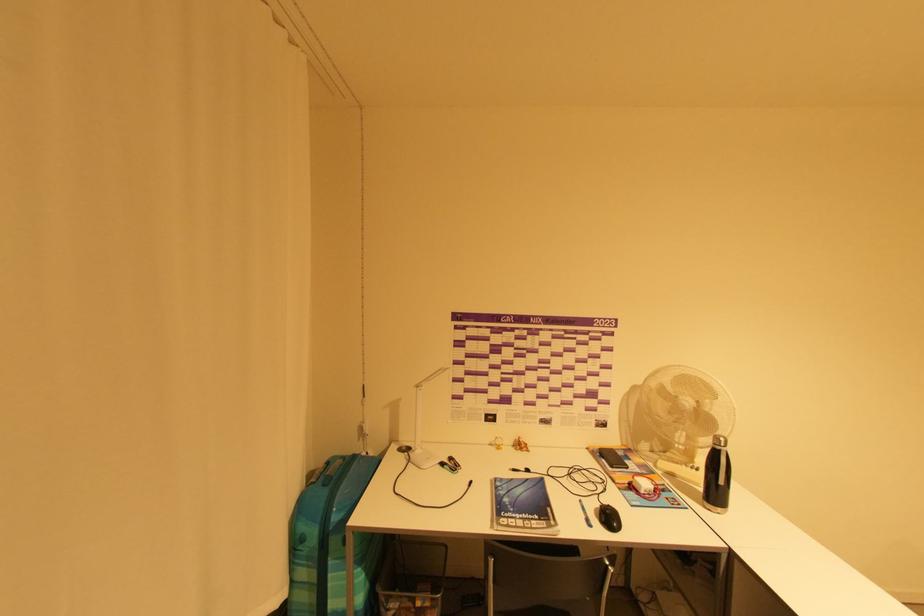
Find where to unscrew the silver bottle cap. Please return your answer as a coordinate pair (x, y).

(719, 440)